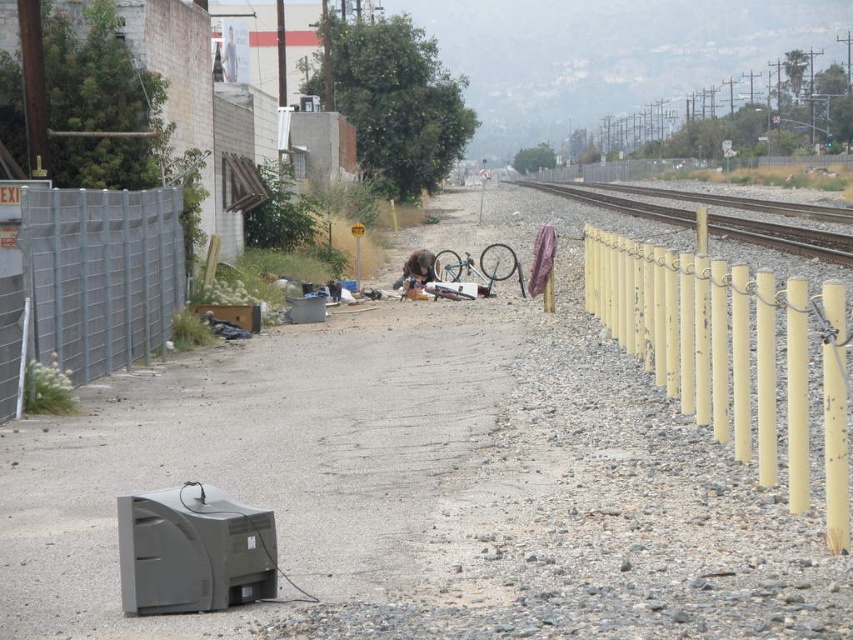
Is yellow painted metal poles at right further to the viewer compared to metallic train track at right?

That is False.

Is yellow painted metal poles at right wider than metallic train track at right?

In fact, yellow painted metal poles at right might be narrower than metallic train track at right.

Who is more distant from viewer, (x=743, y=451) or (x=741, y=241)?

The point (x=741, y=241) is more distant.

The image size is (853, 640). I want to click on yellow painted metal poles at right, so click(x=709, y=342).

Does metallic gray fence at left appear under metallic train track at right?

Indeed, metallic gray fence at left is positioned under metallic train track at right.

Can you confirm if metallic gray fence at left is bigger than metallic train track at right?

No.

Which is in front, point (155, 228) or point (837, 260)?

Point (155, 228) is in front.

The width and height of the screenshot is (853, 640). Identify the location of metallic gray fence at left. (84, 280).

Between point (605, 236) and point (172, 205), which one is positioned behind?

The point (172, 205) is more distant.

Which is more to the left, yellow painted metal poles at right or metallic gray fence at left?

From the viewer's perspective, metallic gray fence at left appears more on the left side.

Who is more distant from viewer, (752, 285) or (10, 390)?

Point (10, 390)

Where is `yellow painted metal poles at right`? This screenshot has width=853, height=640. yellow painted metal poles at right is located at coordinates (709, 342).